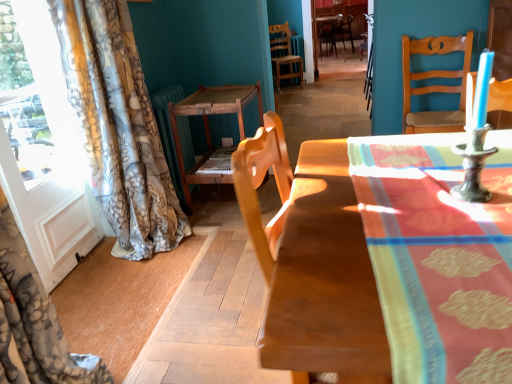
The width and height of the screenshot is (512, 384). In order to click on wooden table at center, marked as the second table in a front-to-back arrangement in this screenshot , I will do `click(209, 129)`.

Image resolution: width=512 pixels, height=384 pixels. In order to click on transparent glass door at left in this screenshot , I will do `click(35, 94)`.

Find the location of a particular element. The width and height of the screenshot is (512, 384). wooden chair at center, which appears as the 3th chair when viewed from the right is located at coordinates click(284, 55).

Where is `wooden table at center, which is counted as the 1th table, starting from the right`? The image size is (512, 384). wooden table at center, which is counted as the 1th table, starting from the right is located at coordinates tap(407, 186).

Would you say wooden chair at right, the 2th chair viewed from the right, is inside or outside metallic candle holder at right?

wooden chair at right, the 2th chair viewed from the right, is spatially situated outside metallic candle holder at right.

Find the location of a particular element. the 1st chair behind the metallic candle holder at right is located at coordinates (434, 85).

Measure the distance from wooden chair at right, which is the 1th chair from front to back, to metallic candle holder at right.

They are 1.86 meters apart.

Between wooden chair at right, which is the third chair in back-to-front order, and metallic candle holder at right, which one is positioned in front?

metallic candle holder at right.

Which point is more distant from viewer, (34, 64) or (351, 31)?

Positioned behind is point (351, 31).

Are transparent glass door at left and wooden chair at center, marked as the third chair in a bottom-to-top arrangement, beside each other?

No, transparent glass door at left is not beside wooden chair at center, marked as the third chair in a bottom-to-top arrangement.

Which of these two, transparent glass door at left or wooden chair at center, marked as the third chair in a left-to-right arrangement, is wider?

Wider between the two is wooden chair at center, marked as the third chair in a left-to-right arrangement.

Is transparent glass door at left shorter than wooden chair at center, marked as the third chair in a left-to-right arrangement?

Incorrect, the height of transparent glass door at left does not fall short of that of wooden chair at center, marked as the third chair in a left-to-right arrangement.

Measure the distance between transparent glass door at left and wooden chair at right, which appears as the 2th chair when viewed from the left.

A distance of 7.33 feet exists between transparent glass door at left and wooden chair at right, which appears as the 2th chair when viewed from the left.

Which of these two, transparent glass door at left or wooden chair at right, which is the 1th chair from front to back, is wider?

Wider between the two is wooden chair at right, which is the 1th chair from front to back.

From the image's perspective, count 1st chairs upward from the transparent glass door at left and point to it. Please provide its 2D coordinates.

[(434, 85)]

From a real-world perspective, which is physically above, transparent glass door at left or wooden chair at right, which appears as the 3th chair when viewed from the top?

transparent glass door at left.

Where is `chair that is the 2nd object located in front of the wooden chair at center, which is the first chair from top to bottom`? chair that is the 2nd object located in front of the wooden chair at center, which is the first chair from top to bottom is located at coordinates (434, 85).

Is point (335, 43) closer to camera compared to point (430, 44)?

No, it is behind (430, 44).

From the image's perspective, is wooden chair at center, marked as the third chair in a left-to-right arrangement, on top of wooden chair at right, which is the 1th chair from front to back?

Indeed, from the image's perspective, wooden chair at center, marked as the third chair in a left-to-right arrangement, is shown above wooden chair at right, which is the 1th chair from front to back.

Which object is further away from the camera taking this photo, wooden chair at center, marked as the third chair in a bottom-to-top arrangement, or metallic candle holder at right?

wooden chair at center, marked as the third chair in a bottom-to-top arrangement, is behind.

From a real-world perspective, count 2nd chairs downward from the metallic candle holder at right and point to it. Please provide its 2D coordinates.

[(333, 31)]

From the image's perspective, between wooden chair at center, acting as the first chair starting from the back, and metallic candle holder at right, who is located below?

metallic candle holder at right, from the image's perspective.

Is wooden chair at center, marked as the third chair in a left-to-right arrangement, aimed at metallic candle holder at right?

Yes, wooden chair at center, marked as the third chair in a left-to-right arrangement, is oriented towards metallic candle holder at right.

Is transparent glass door at left to the right of wooden table at center, the 1th table when ordered from front to back, from the viewer's perspective?

Incorrect, transparent glass door at left is not on the right side of wooden table at center, the 1th table when ordered from front to back.

Which is in front, transparent glass door at left or wooden table at center, which is the second table from back to front?

wooden table at center, which is the second table from back to front, is in front.

From the picture: Is transparent glass door at left outside of wooden table at center, which is counted as the 1th table, starting from the right?

transparent glass door at left lies outside wooden table at center, which is counted as the 1th table, starting from the right,'s area.

Between point (34, 8) and point (441, 147), which one is positioned in front?

The point (441, 147) is closer to the camera.

Would you consider metallic candle holder at right to be distant from wooden chair at right, which appears as the 2th chair when viewed from the left?

metallic candle holder at right is positioned a significant distance from wooden chair at right, which appears as the 2th chair when viewed from the left.

Does metallic candle holder at right have a greater width compared to wooden chair at right, which appears as the 3th chair when viewed from the top?

In fact, metallic candle holder at right might be narrower than wooden chair at right, which appears as the 3th chair when viewed from the top.

How many degrees apart are the facing directions of metallic candle holder at right and wooden chair at right, which is the third chair in back-to-front order?

4.98 degrees separate the facing orientations of metallic candle holder at right and wooden chair at right, which is the third chair in back-to-front order.

Could you tell me if metallic candle holder at right is turned towards wooden chair at right, which appears as the 3th chair when viewed from the top?

No, metallic candle holder at right is not facing towards wooden chair at right, which appears as the 3th chair when viewed from the top.

Starting from the metallic candle holder at right, which chair is the 2nd one to the right? Please provide its 2D coordinates.

[(434, 85)]

Where is `window that is above the wooden chair at center, marked as the third chair in a bottom-to-top arrangement (from a real-world perspective)`? The width and height of the screenshot is (512, 384). window that is above the wooden chair at center, marked as the third chair in a bottom-to-top arrangement (from a real-world perspective) is located at coordinates (35, 94).

From the image, which object appears to be farther from floral-patterned fabric at left, wooden chair at right, which appears as the 3th chair when viewed from the top, or wooden chair at center, the 2th chair from the back?

wooden chair at center, the 2th chair from the back, is positioned further to the anchor floral-patterned fabric at left.

From the image, which object appears to be farther from wooden chair at right, which appears as the 2th chair when viewed from the left, transparent glass door at left or wooden chair at center, which appears as the 3th chair when viewed from the right?

Among the two, wooden chair at center, which appears as the 3th chair when viewed from the right, is located further to wooden chair at right, which appears as the 2th chair when viewed from the left.

Considering their positions, is transparent glass door at left positioned further to wooden chair at right, which is the third chair in back-to-front order, than wooden table at center, arranged as the second table when viewed from the right?

transparent glass door at left is further to wooden chair at right, which is the third chair in back-to-front order.

Considering their positions, is metallic candle holder at right positioned further to wooden table at center, which is counted as the 1th table, starting from the right, than floral-patterned fabric at left?

Among the two, floral-patterned fabric at left is located further to wooden table at center, which is counted as the 1th table, starting from the right.

Considering their positions, is wooden chair at center, marked as the 3th chair in a front-to-back arrangement, positioned closer to transparent glass door at left than wooden chair at center, the 1th chair in the left-to-right sequence?

wooden chair at center, the 1th chair in the left-to-right sequence, lies closer to transparent glass door at left than the other object.

Considering their positions, is wooden table at center, acting as the first table starting from the back, positioned further to metallic candle holder at right than wooden chair at center, acting as the first chair starting from the right?

The object further to metallic candle holder at right is wooden chair at center, acting as the first chair starting from the right.

Looking at this image, considering their positions, is transparent glass door at left positioned closer to metallic candle holder at right than wooden chair at center, marked as the third chair in a left-to-right arrangement?

Based on the image, transparent glass door at left appears to be nearer to metallic candle holder at right.

Based on their spatial positions, is wooden table at center, marked as the second table in a front-to-back arrangement, or metallic candle holder at right closer to wooden table at center, which is counted as the 1th table, starting from the right?

The object closer to wooden table at center, which is counted as the 1th table, starting from the right, is metallic candle holder at right.

This screenshot has width=512, height=384. In order to click on window between metallic candle holder at right and wooden table at center, which ranks as the 1th table in left-to-right order, in the front-back direction in this screenshot , I will do `click(35, 94)`.

Identify the location of window between wooden table at center, the second table when ordered from left to right, and wooden chair at center, acting as the first chair starting from the back, from front to back. Image resolution: width=512 pixels, height=384 pixels. (35, 94).

You are a GUI agent. You are given a task and a screenshot of the screen. Output one action in this format:
    pyautogui.click(x=<x>, y=<y>)
    Task: Click on the curtain between wooden table at center, the second table when ordered from left to right, and wooden chair at center, which appears as the 3th chair when viewed from the right, from front to back
    The image size is (512, 384).
    Given the screenshot: What is the action you would take?
    pyautogui.click(x=118, y=126)

The width and height of the screenshot is (512, 384). I want to click on candle holder between wooden table at center, the 1th table when ordered from front to back, and floral-patterned fabric at left, along the z-axis, so click(x=475, y=147).